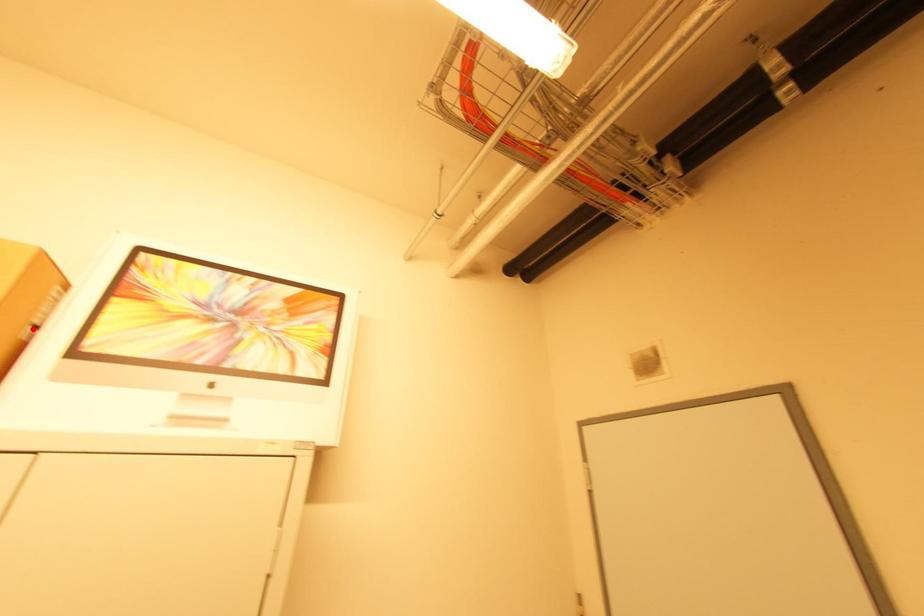
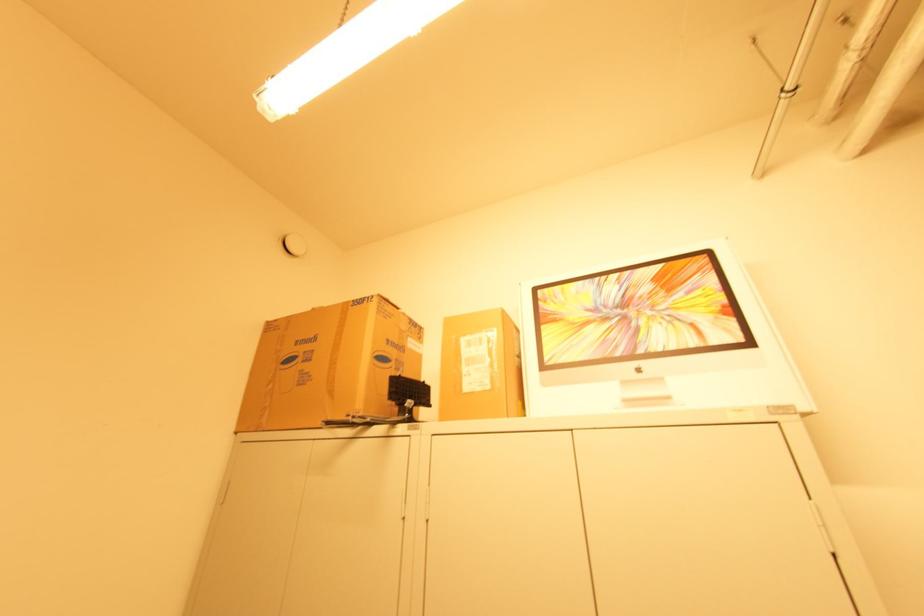
The point at the highlighted location is marked in the first image. Where is the corresponding point in the second image?

(520, 359)